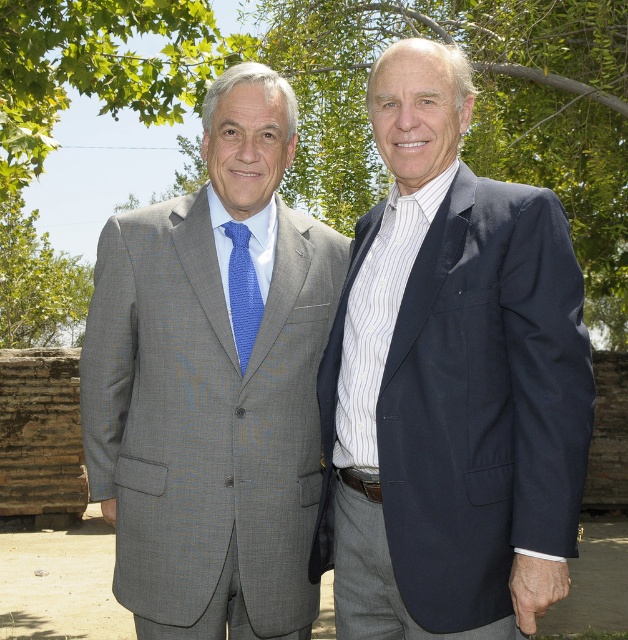
Measure the distance between gray textured suit at center and camera.

They are 3.01 meters apart.

Can you confirm if gray textured suit at center is positioned to the left of green leafy tree at upper center?

Yes, gray textured suit at center is to the left of green leafy tree at upper center.

Who is more forward, (102, 413) or (295, 86)?

Point (102, 413) is more forward.

At what (x,y) coordinates should I click in order to perform the action: click on gray textured suit at center. Please return your answer as a coordinate pair (x, y). This screenshot has width=628, height=640. Looking at the image, I should click on (207, 416).

Between gray textured suit at center and green leafy tree at upper left, which one has less height?

With less height is green leafy tree at upper left.

This screenshot has width=628, height=640. In order to click on gray textured suit at center in this screenshot , I will do `click(207, 416)`.

Which is in front, point (109, 472) or point (176, 97)?

Point (109, 472)

The width and height of the screenshot is (628, 640). I want to click on gray textured suit at center, so click(x=207, y=416).

Is gray textured suit at center taller than blue textured tie at center?

Indeed, gray textured suit at center has a greater height compared to blue textured tie at center.

Who is more forward, (322, 301) or (247, 316)?

Positioned in front is point (247, 316).

Identify the location of gray textured suit at center. (207, 416).